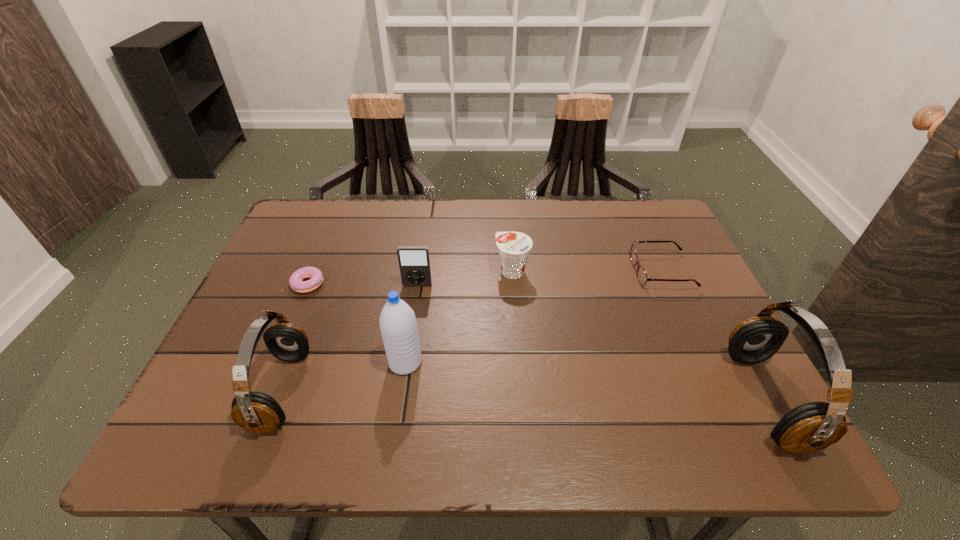
Locate an element on the screen. This screenshot has width=960, height=540. free spot located on the ear cups of the taller headset is located at coordinates (636, 399).

Find the location of a particular element. This screenshot has height=540, width=960. vacant space situated 0.130m on the ear cups of the taller headset is located at coordinates (675, 399).

Find the location of a particular element. The height and width of the screenshot is (540, 960). free spot located on the ear cups of the taller headset is located at coordinates (620, 399).

Where is `vacant area located 0.400m on the left of the yogurt`? Image resolution: width=960 pixels, height=540 pixels. vacant area located 0.400m on the left of the yogurt is located at coordinates (344, 271).

What are the coordinates of `vacant position located 0.190m on the front-facing side of the fourth tallest object` in the screenshot? It's located at (408, 347).

Locate an element on the screen. The height and width of the screenshot is (540, 960). blank space located 0.050m on the back of the doughnut is located at coordinates point(316,261).

Identify the location of vacant space located 0.370m on the left of the water bottle. (217, 362).

Where is `free space located on the lenses of the second shortest object`? free space located on the lenses of the second shortest object is located at coordinates (578, 271).

I want to click on free region located 0.330m on the lenses of the second shortest object, so click(510, 271).

In order to click on vacant space located on the lenses of the second shortest object in this screenshot , I will do click(x=555, y=271).